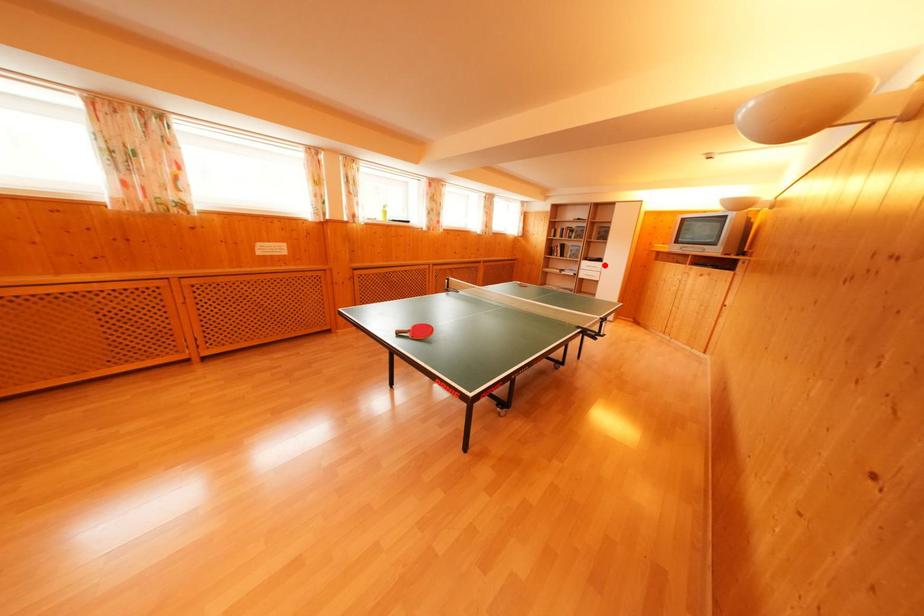
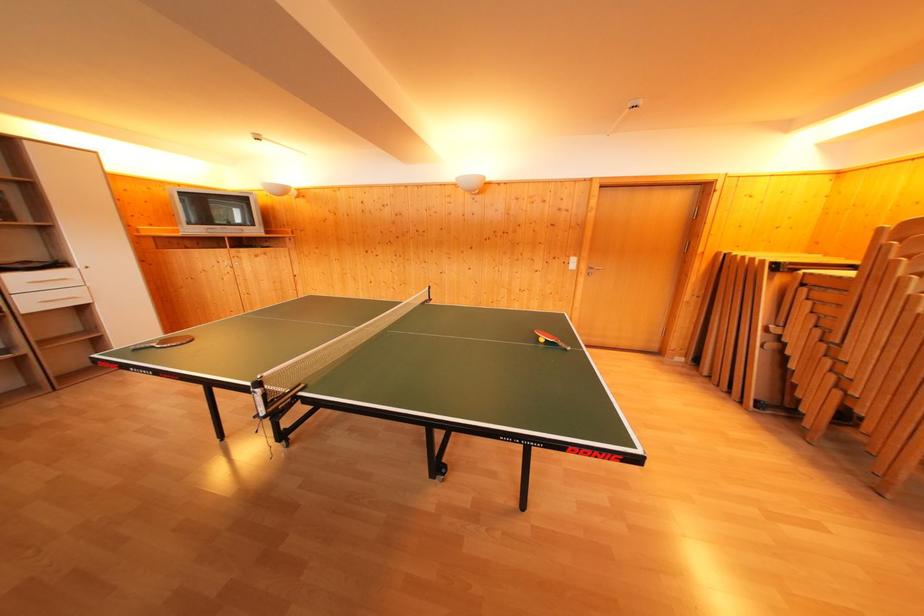
Question: I am providing you with two images of the same scene from different viewpoints. In image1, a red point is highlighted. Considering the same 3D point in image2, which of the following is correct?

Choices:
 (A) It is closer
 (B) It is farther

Answer: (B)